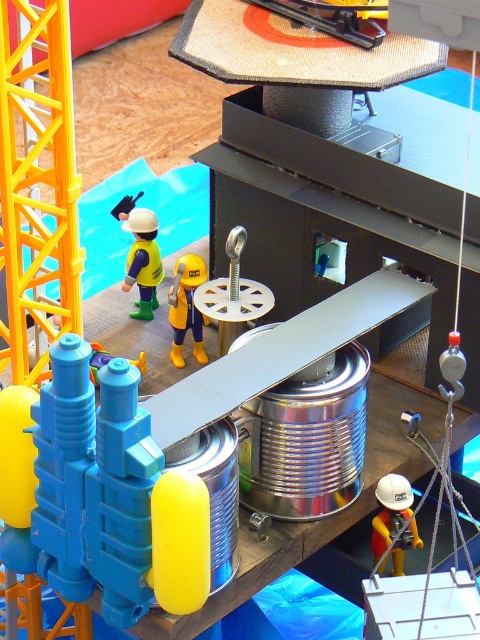
You are a toy designer evaluating the miniature construction site. The yellow matte construction worker at center and the yellow rubber boots at center are part of the set. Which object is wider?

The yellow matte construction worker at center is wider than the yellow rubber boots at center according to the description.

You are a parent setting up a toy construction set for your child. You notice the yellow matte construction worker at center and the yellow rubber boots at center. Which object is placed higher in the scene?

The yellow matte construction worker at center is positioned over the yellow rubber boots at center, so the construction worker is higher up.

You are a toy collector examining this construction site set. You notice the white matte hard hat at lower right and the yellow rubber boots at center. Which object is shorter in height?

The white matte hard hat at lower right is not as tall as the yellow rubber boots at center, so the white matte hard hat at lower right is shorter in height.